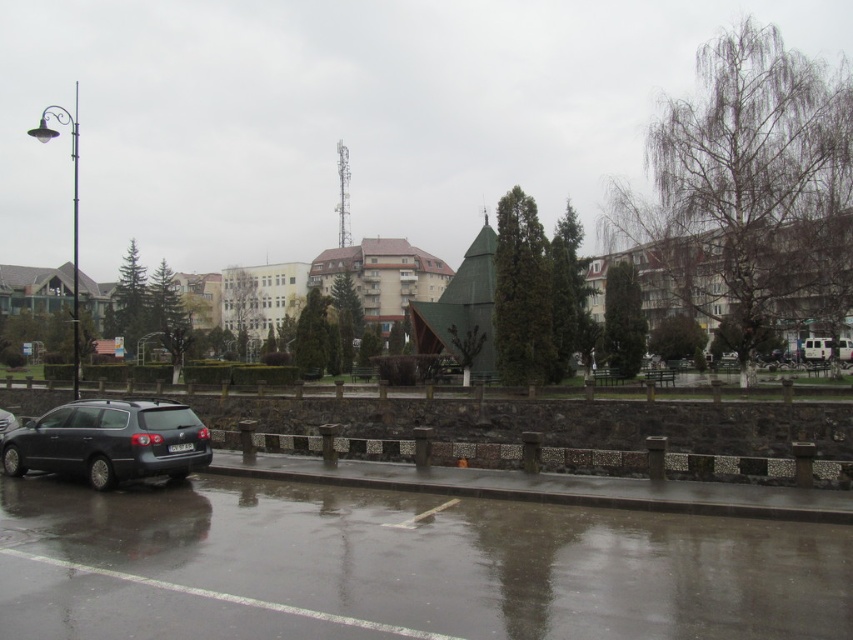
You are a pedestrian standing on the sidewalk and see both the satin black station wagon at lower left and the satin black sedan at left. Which car is closer to you?

The satin black station wagon at lower left is closer to you because it is positioned in front of the satin black sedan at left.

You are a delivery person trying to park your 1.8 meters tall delivery box between the satin black station wagon at lower left and the metallic silver suv at lower right. Can the delivery box fit vertically between them based on their heights?

The satin black station wagon at lower left has a greater height compared to metallic silver suv at lower right. Since the delivery box is 1.8 meters tall, it can fit vertically between them as long as the shorter vehicle allows enough clearance. However, without specific height measurements of both vehicles, we cannot confirm if the space is sufficient. Please check the actual heights.